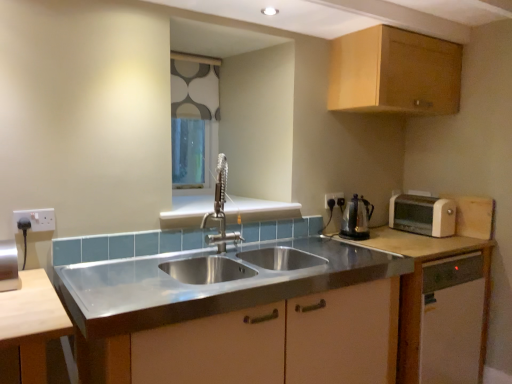
Image resolution: width=512 pixels, height=384 pixels. I want to click on free spot below white plastic toaster at right (from a real-world perspective), so click(419, 226).